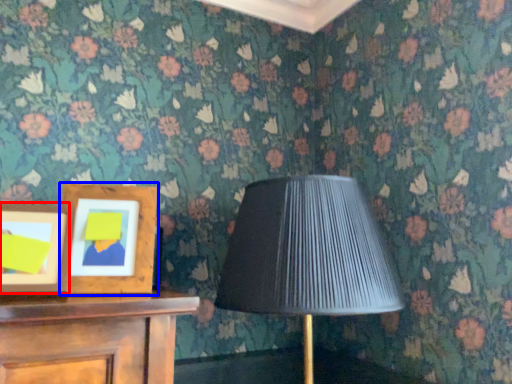
Question: Which point is further to the camera, picture frame (highlighted by a red box) or picture frame (highlighted by a blue box)?

Choices:
 (A) picture frame
 (B) picture frame

Answer: (B)